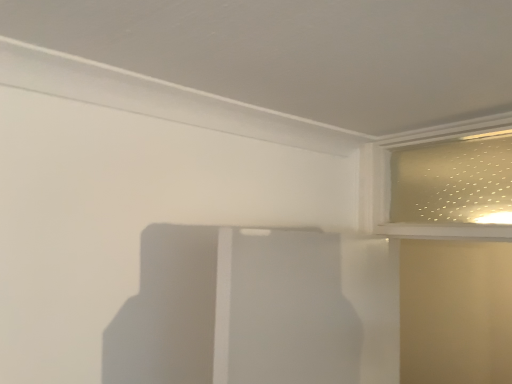
Describe the element at coordinates (441, 183) in the screenshot. I see `translucent frosted glass at upper right` at that location.

Where is `translucent frosted glass at upper right`? This screenshot has height=384, width=512. translucent frosted glass at upper right is located at coordinates (441, 183).

Locate an element on the screen. The image size is (512, 384). translucent frosted glass at upper right is located at coordinates (441, 183).